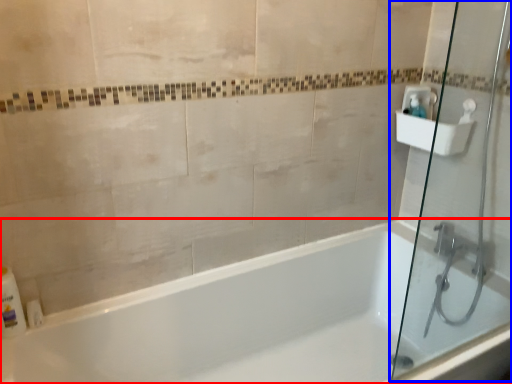
Question: Which object is closer to the camera taking this photo, bathtub (highlighted by a red box) or shower door (highlighted by a blue box)?

Choices:
 (A) bathtub
 (B) shower door

Answer: (A)